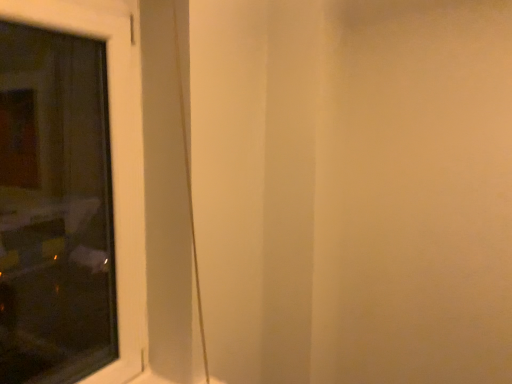
The width and height of the screenshot is (512, 384). What do you see at coordinates (113, 156) in the screenshot?
I see `white plastic window at left` at bounding box center [113, 156].

Where is `white plastic window at left`? white plastic window at left is located at coordinates (113, 156).

Locate an element on the screen. The image size is (512, 384). white plastic window at left is located at coordinates 113,156.